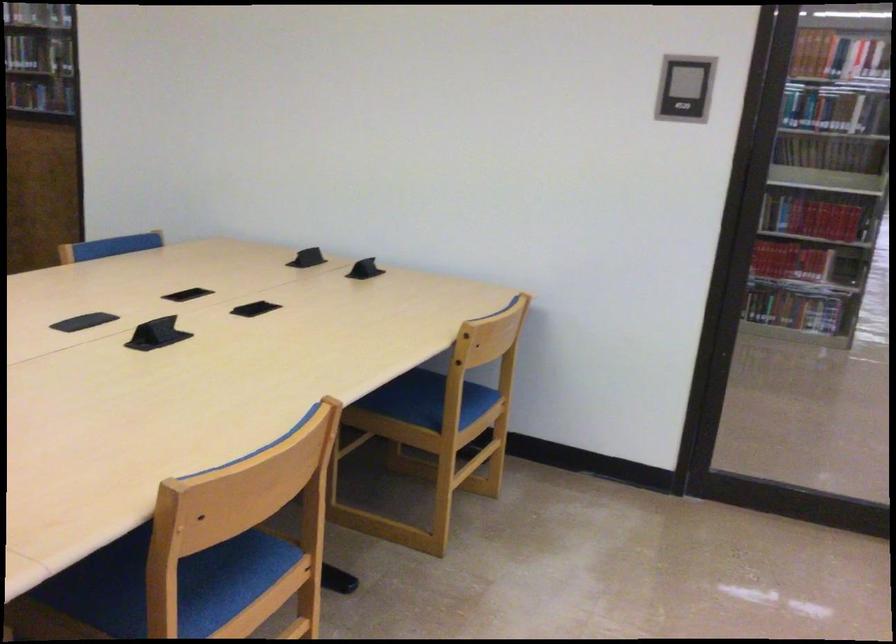
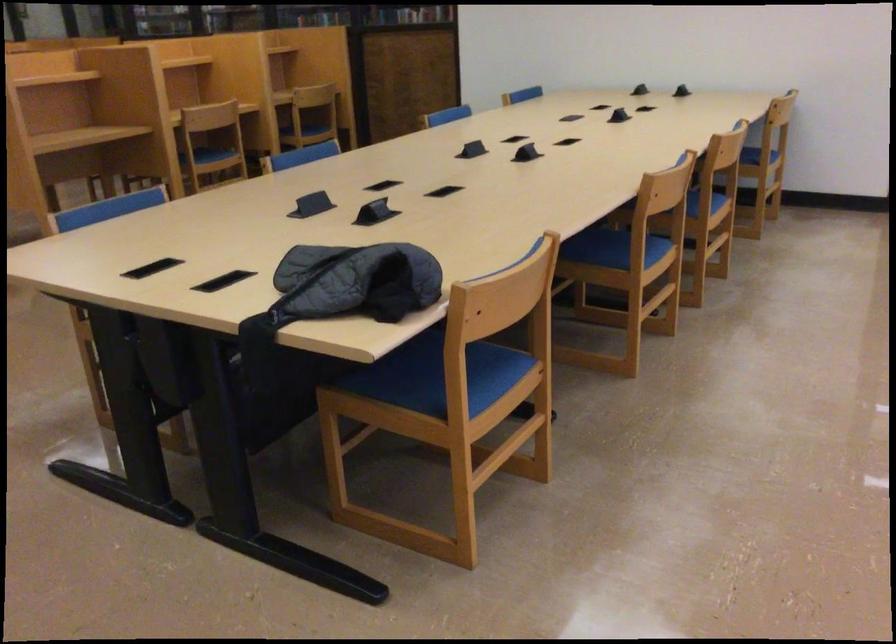
In the second image, find the point that corresponds to [440,450] in the first image.

(760, 169)